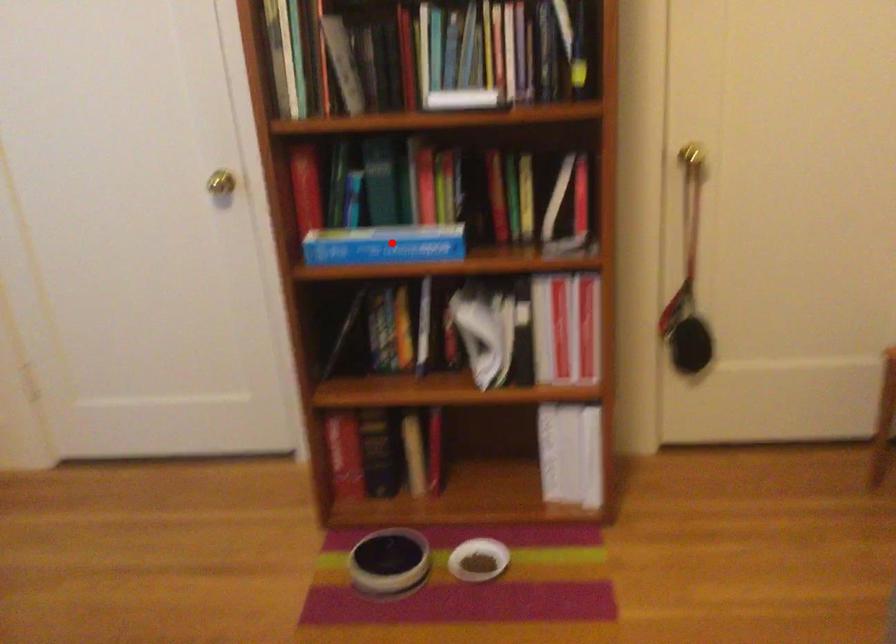
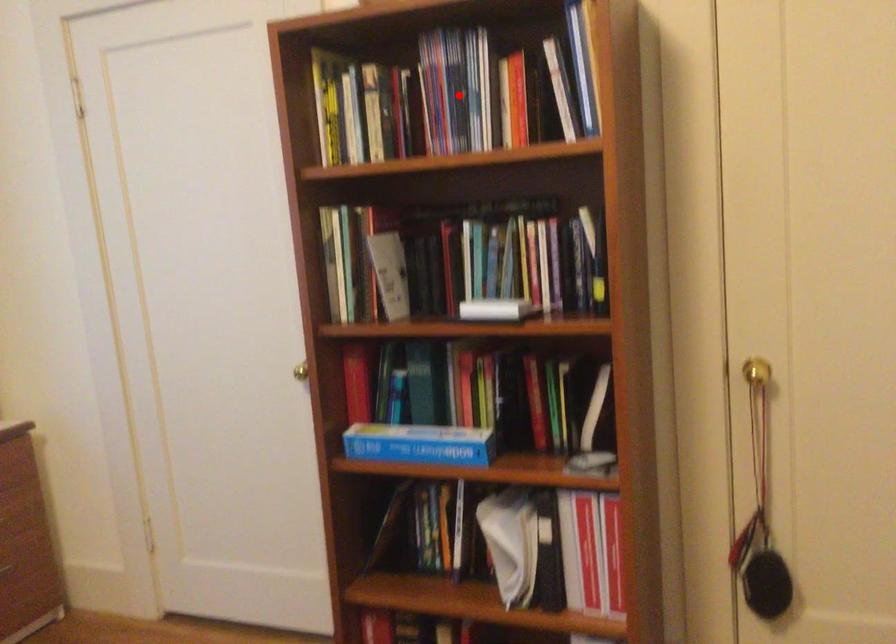
I am providing you with two images of the same scene from different viewpoints. A red point is marked on the first image and another point is marked on the second image. Do the highlighted points in image1 and image2 indicate the same real-world spot?

No